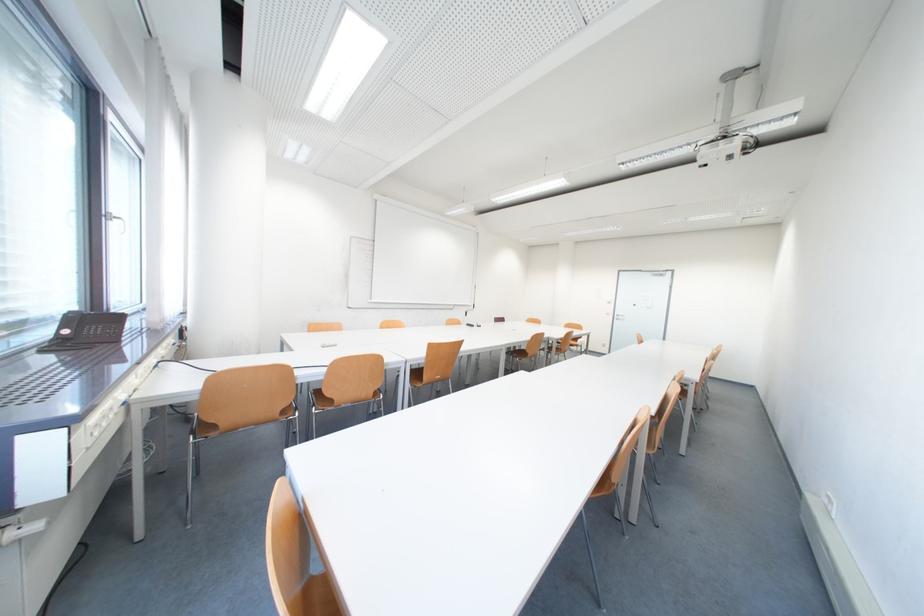
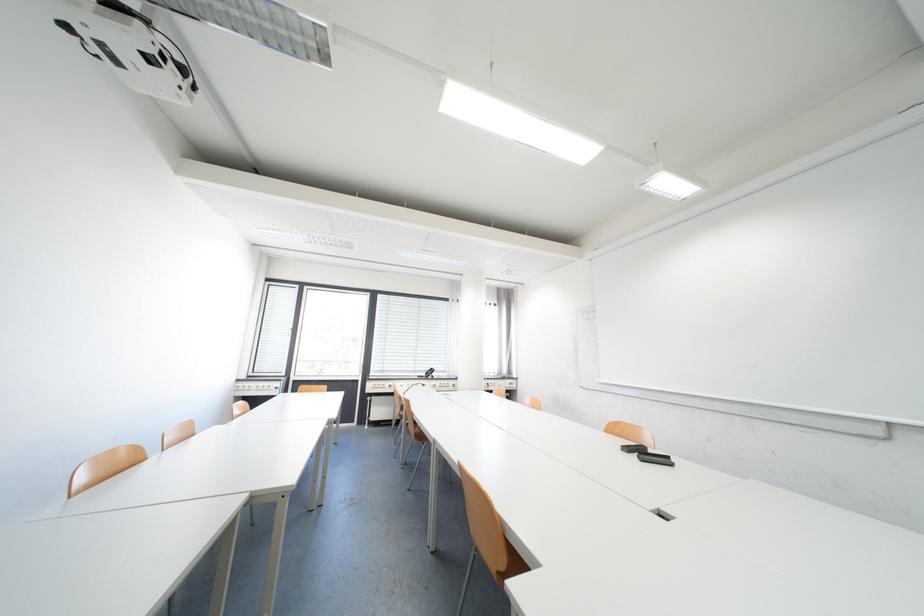
Question: I am providing you with two images of the same scene from different viewpoints. Please identify which objects are invisible in image2.

Choices:
 (A) white cloth bag
 (B) brown chair sitting surface
 (C) black board eraser
 (D) projector screen handle

Answer: (B)